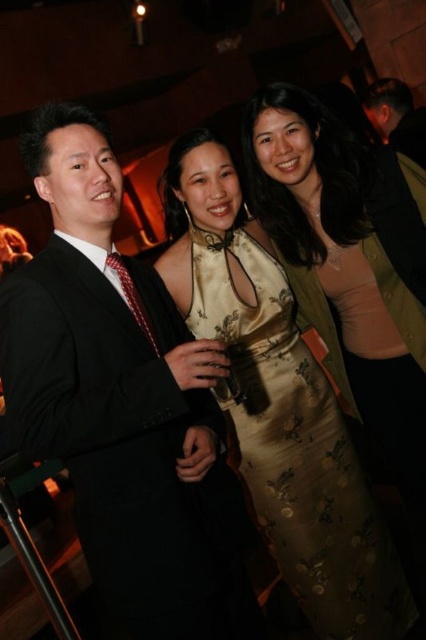
Can you confirm if black satin suit at left is taller than silky gold dress at center?

Correct, black satin suit at left is much taller as silky gold dress at center.

Between black satin suit at left and silky gold dress at center, which one appears on the right side from the viewer's perspective?

Positioned to the right is silky gold dress at center.

Which is in front, point (109, 560) or point (290, 346)?

Positioned in front is point (109, 560).

Where is `black satin suit at left`? The image size is (426, 640). black satin suit at left is located at coordinates (123, 403).

Is point (275, 372) farther from viewer compared to point (399, 145)?

That is False.

Does silky gold dress at center appear on the left side of black suit at upper right?

Indeed, silky gold dress at center is positioned on the left side of black suit at upper right.

Image resolution: width=426 pixels, height=640 pixels. Identify the location of silky gold dress at center. (296, 449).

I want to click on black satin suit at left, so click(123, 403).

This screenshot has width=426, height=640. Find the location of `black satin suit at left`. black satin suit at left is located at coordinates (123, 403).

This screenshot has height=640, width=426. I want to click on black satin suit at left, so click(x=123, y=403).